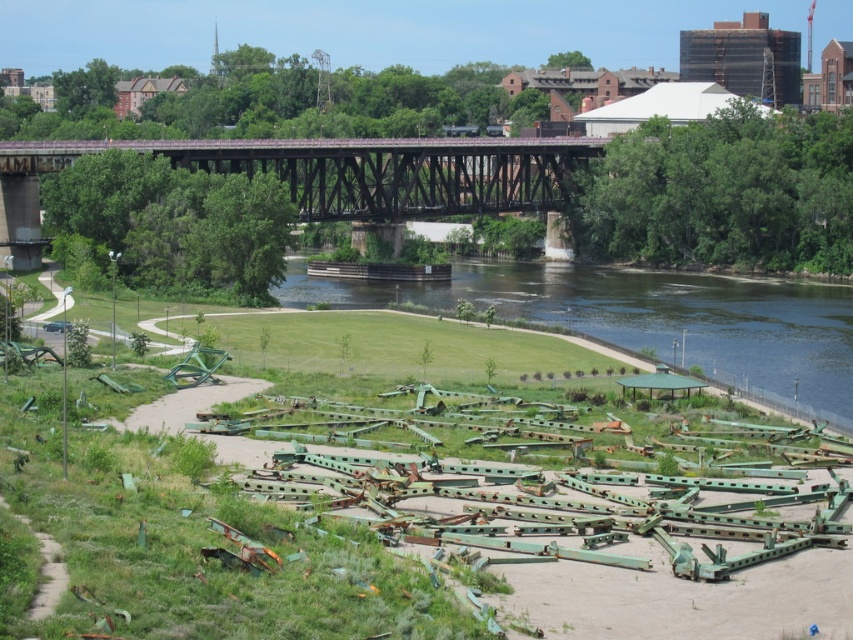
You are standing at the origin point of the coordinate system. You want to walk to the green grass at lower center. What are the coordinates you need to reach?

The coordinates you need to reach are point (650, 320).

From the picture: You are planning to set up a picnic area in the riverside scene. You have a large picnic blanket that covers the entire green grass at lower center. Can you also place a small bench on the rusty metal bridge at upper center without it overlapping with the grass?

The green grass at lower center is bigger than the rusty metal bridge at upper center. Since the bench is small and the bridge is smaller than the grass area, the bench can be placed on the rusty metal bridge at upper center without overlapping with the grass.